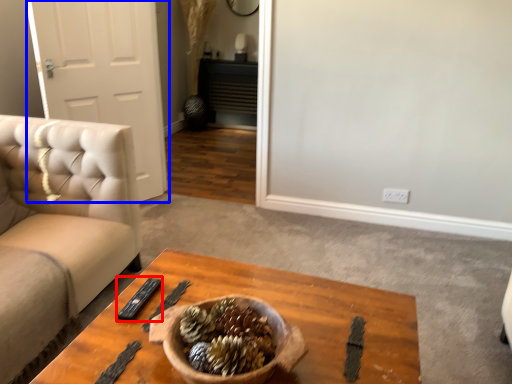
Question: Among these objects, which one is nearest to the camera, remote (highlighted by a red box) or door (highlighted by a blue box)?

Choices:
 (A) remote
 (B) door

Answer: (A)